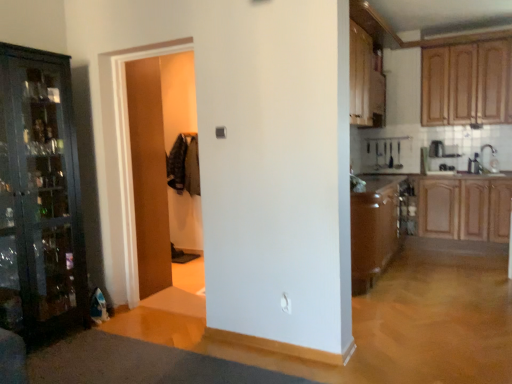
Question: Could you tell me if white glossy sink at right is turned towards wooden cabinet at upper right, which is the second cabinetry in top-to-bottom order?

Choices:
 (A) yes
 (B) no

Answer: (B)

Question: Considering the relative sizes of white glossy sink at right and wooden cabinet at upper right, which is the second cabinetry in top-to-bottom order, in the image provided, is white glossy sink at right taller than wooden cabinet at upper right, which is the second cabinetry in top-to-bottom order,?

Choices:
 (A) no
 (B) yes

Answer: (A)

Question: Is white glossy sink at right in front of wooden cabinet at upper right, marked as the second cabinetry in a bottom-to-top arrangement?

Choices:
 (A) yes
 (B) no

Answer: (B)

Question: Considering the relative positions of white glossy sink at right and wooden cabinet at upper right, marked as the second cabinetry in a bottom-to-top arrangement, in the image provided, is white glossy sink at right behind wooden cabinet at upper right, marked as the second cabinetry in a bottom-to-top arrangement,?

Choices:
 (A) no
 (B) yes

Answer: (B)

Question: Is white glossy sink at right directly adjacent to wooden cabinet at upper right, which is the second cabinetry in top-to-bottom order?

Choices:
 (A) yes
 (B) no

Answer: (B)

Question: Is white glossy sink at right inside the boundaries of wooden cabinet at upper right, marked as the second cabinetry in a bottom-to-top arrangement, or outside?

Choices:
 (A) outside
 (B) inside

Answer: (A)

Question: Relative to wooden cabinet at upper right, which is the second cabinetry in top-to-bottom order, is white glossy sink at right in front or behind?

Choices:
 (A) front
 (B) behind

Answer: (B)

Question: Looking at their shapes, would you say white glossy sink at right is wider or thinner than wooden cabinet at upper right, which is the second cabinetry in top-to-bottom order?

Choices:
 (A) thin
 (B) wide

Answer: (A)

Question: From a real-world perspective, is white glossy sink at right above or below wooden cabinet at upper right, which is the second cabinetry in top-to-bottom order?

Choices:
 (A) above
 (B) below

Answer: (B)

Question: From the image's perspective, is wooden door at center above or below white glossy sink at right?

Choices:
 (A) above
 (B) below

Answer: (B)

Question: Considering the positions of point (148, 254) and point (478, 170), is point (148, 254) closer or farther from the camera than point (478, 170)?

Choices:
 (A) farther
 (B) closer

Answer: (B)

Question: In the image, is wooden door at center positioned in front of or behind white glossy sink at right?

Choices:
 (A) behind
 (B) front

Answer: (B)

Question: In terms of height, does wooden door at center look taller or shorter compared to white glossy sink at right?

Choices:
 (A) tall
 (B) short

Answer: (A)

Question: Looking at the image, does wooden cabinets at upper right, the third cabinetry ordered from the bottom, seem bigger or smaller compared to wooden cabinet at right, marked as the first cabinetry in a bottom-to-top arrangement?

Choices:
 (A) big
 (B) small

Answer: (B)

Question: Do you think wooden cabinets at upper right, marked as the 1th cabinetry in a top-to-bottom arrangement, is within wooden cabinet at right, marked as the first cabinetry in a bottom-to-top arrangement, or outside of it?

Choices:
 (A) inside
 (B) outside

Answer: (B)